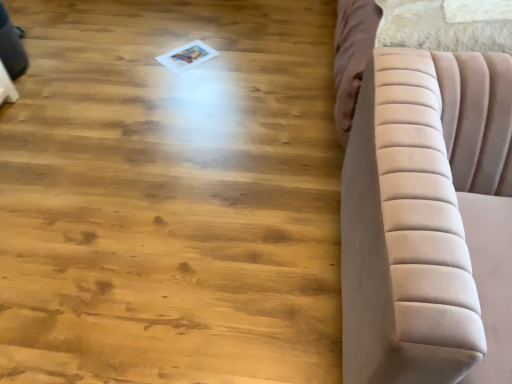
The height and width of the screenshot is (384, 512). I want to click on free spot above natural wood floor at center (from a real-world perspective), so click(x=135, y=128).